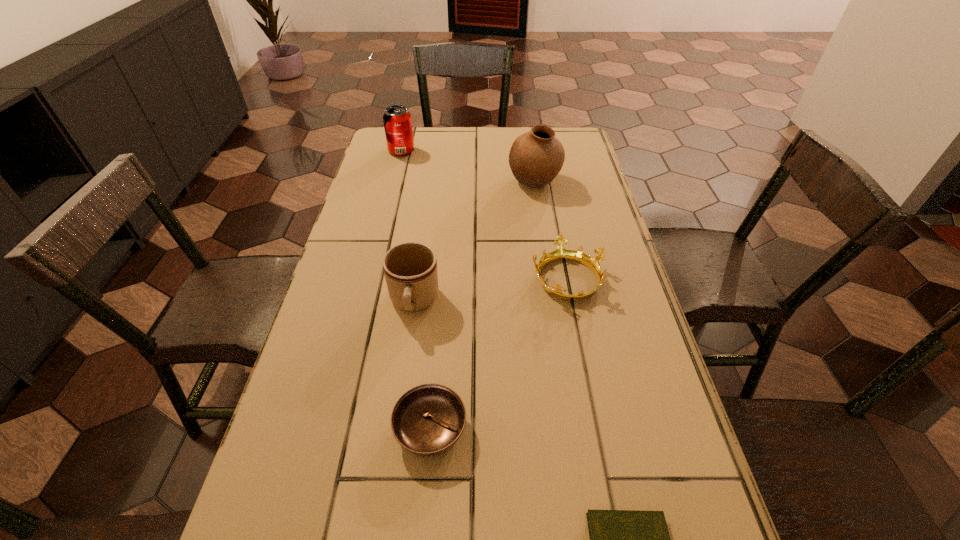
At what (x,y) coordinates should I click in order to perform the action: click on object that is the closest to the soda can. Please return your answer as a coordinate pair (x, y). Looking at the image, I should click on tap(536, 157).

Point out which object is positioned as the fifth nearest to the fifth tallest object. Please provide its 2D coordinates. Your answer should be formatted as a tuple, i.e. [(x, y)], where the tuple contains the x and y coordinates of a point satisfying the conditions above.

[(397, 120)]

Find the location of a particular element. vacant point that satisfies the following two spatial constraints: 1. on the front side of the third shortest object; 2. on the left side of the pottery is located at coordinates (549, 278).